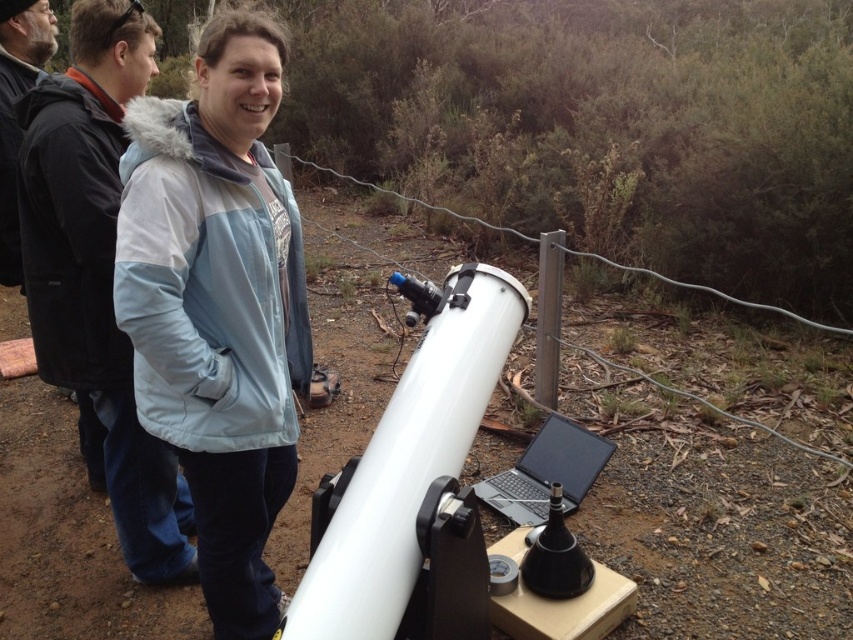
Question: Estimate the real-world distances between objects in this image. Which object is farther from the white matte telescope at center?

Choices:
 (A) light blue puffy jacket at center
 (B) black fuzzy jacket at left

Answer: (B)

Question: Estimate the real-world distances between objects in this image. Which object is farther from the white matte telescope at center?

Choices:
 (A) black fleece jacket at upper left
 (B) black fuzzy jacket at left
 (C) light blue puffy jacket at center

Answer: (B)

Question: Which of the following is the farthest from the observer?

Choices:
 (A) (136, 561)
 (B) (6, 172)

Answer: (B)

Question: Can you confirm if light blue puffy jacket at center is smaller than black fuzzy jacket at left?

Choices:
 (A) yes
 (B) no

Answer: (B)

Question: Can you confirm if light blue puffy jacket at center is wider than black fleece jacket at upper left?

Choices:
 (A) no
 (B) yes

Answer: (A)

Question: Is black fleece jacket at upper left thinner than black fuzzy jacket at left?

Choices:
 (A) yes
 (B) no

Answer: (B)